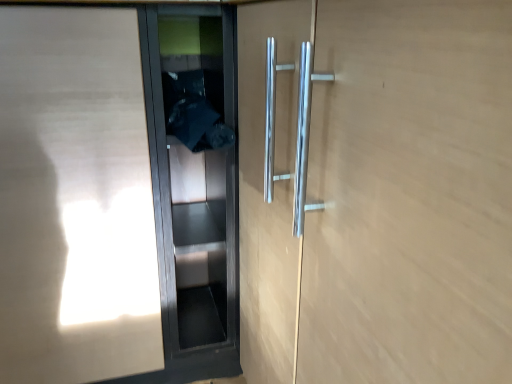
Question: Choose the correct answer: Is black glass elevator door at center, the second elevator door in the left-to-right sequence, inside matte wood elevator door at left, acting as the first elevator door starting from the left, or outside it?

Choices:
 (A) inside
 (B) outside

Answer: (B)

Question: Based on their sizes in the image, would you say black glass elevator door at center, the first elevator door in the right-to-left sequence, is bigger or smaller than matte wood elevator door at left, arranged as the second elevator door when viewed from the right?

Choices:
 (A) small
 (B) big

Answer: (A)

Question: In the image, is black glass elevator door at center, the second elevator door in the left-to-right sequence, positioned in front of or behind matte wood elevator door at left, acting as the first elevator door starting from the left?

Choices:
 (A) behind
 (B) front

Answer: (A)

Question: Is point (19, 105) closer or farther from the camera than point (216, 18)?

Choices:
 (A) farther
 (B) closer

Answer: (B)

Question: Considering the positions of matte wood elevator door at left, arranged as the second elevator door when viewed from the right, and black glass elevator door at center, the first elevator door in the right-to-left sequence, in the image, is matte wood elevator door at left, arranged as the second elevator door when viewed from the right, wider or thinner than black glass elevator door at center, the first elevator door in the right-to-left sequence,?

Choices:
 (A) wide
 (B) thin

Answer: (A)

Question: In terms of size, does matte wood elevator door at left, arranged as the second elevator door when viewed from the right, appear bigger or smaller than black glass elevator door at center, the second elevator door in the left-to-right sequence?

Choices:
 (A) big
 (B) small

Answer: (A)

Question: Visually, is matte wood elevator door at left, acting as the first elevator door starting from the left, positioned to the left or to the right of black glass elevator door at center, the first elevator door in the right-to-left sequence?

Choices:
 (A) left
 (B) right

Answer: (A)